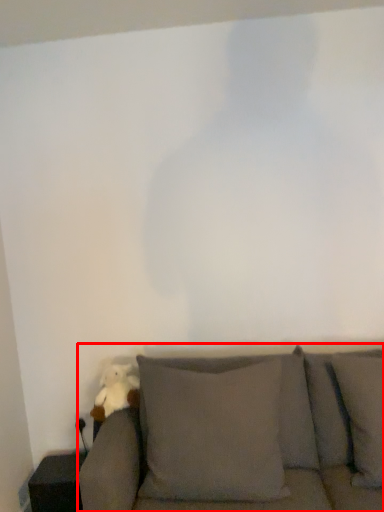
Question: From the image's perspective, what is the correct spatial positioning of studio couch (annotated by the red box) in reference to toy?

Choices:
 (A) below
 (B) above

Answer: (A)